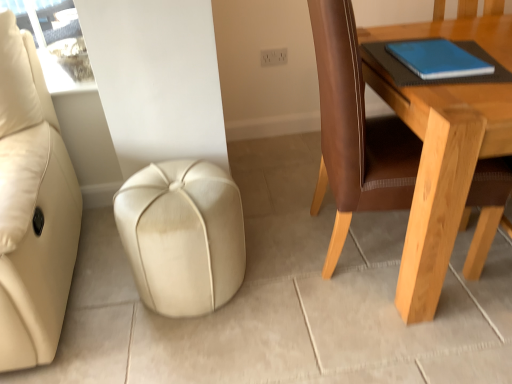
What are the coordinates of `blue matte notebook at upper right` in the screenshot? It's located at (438, 59).

Measure the distance from beige leather ottoman at center to light brown wooden table at right.

beige leather ottoman at center and light brown wooden table at right are 55.42 centimeters apart from each other.

Is beige leather ottoman at center smaller than light brown wooden table at right?

Yes, beige leather ottoman at center is smaller than light brown wooden table at right.

Who is shorter, beige leather ottoman at center or light brown wooden table at right?

Standing shorter between the two is beige leather ottoman at center.

Based on the photo, could you tell me if beige leather ottoman at center is turned towards light brown wooden table at right?

No, beige leather ottoman at center is not turned towards light brown wooden table at right.

In terms of size, does beige leather ottoman at center appear bigger or smaller than blue matte notebook at upper right?

Clearly, beige leather ottoman at center is larger in size than blue matte notebook at upper right.

Which of these two, beige leather ottoman at center or blue matte notebook at upper right, stands shorter?

With less height is blue matte notebook at upper right.

From a real-world perspective, is beige leather ottoman at center located beneath blue matte notebook at upper right?

Yes, from a real-world perspective, beige leather ottoman at center is beneath blue matte notebook at upper right.

Which is behind, beige leather ottoman at center or blue matte notebook at upper right?

beige leather ottoman at center is further from the camera.

Considering the sizes of objects blue matte notebook at upper right and light brown wooden table at right in the image provided, who is taller, blue matte notebook at upper right or light brown wooden table at right?

Standing taller between the two is light brown wooden table at right.

Is blue matte notebook at upper right facing towards light brown wooden table at right?

No, blue matte notebook at upper right is not turned towards light brown wooden table at right.

Would you say blue matte notebook at upper right is to the left or to the right of light brown wooden table at right in the picture?

blue matte notebook at upper right is to the left of light brown wooden table at right.

Which object is more forward, blue matte notebook at upper right or beige leather ottoman at center?

blue matte notebook at upper right.

How much distance is there between blue matte notebook at upper right and beige leather ottoman at center?

A distance of 34.69 inches exists between blue matte notebook at upper right and beige leather ottoman at center.

From the picture: Is blue matte notebook at upper right not close to beige leather ottoman at center?

No, blue matte notebook at upper right is not far from beige leather ottoman at center.

How different are the orientations of light brown wooden table at right and beige leather ottoman at center in degrees?

They differ by 1.3 degrees in their facing directions.

Is light brown wooden table at right turned away from beige leather ottoman at center?

No, light brown wooden table at right is not facing away from beige leather ottoman at center.

From a real-world perspective, is light brown wooden table at right physically above beige leather ottoman at center?

Yes.

Between light brown wooden table at right and beige leather ottoman at center, which one appears on the right side from the viewer's perspective?

light brown wooden table at right is more to the right.

Is light brown wooden table at right with blue matte notebook at upper right?

They are not placed beside each other.

Is light brown wooden table at right further to the viewer compared to blue matte notebook at upper right?

No, light brown wooden table at right is in front of blue matte notebook at upper right.

Is point (510, 60) more distant than point (466, 69)?

That is True.

What's the angular difference between light brown wooden table at right and blue matte notebook at upper right's facing directions?

1.03 degrees.

The height and width of the screenshot is (384, 512). In order to click on stool below the light brown wooden table at right (from the image's perspective) in this screenshot , I will do `click(182, 236)`.

Where is `stool on the left side of blue matte notebook at upper right`? The image size is (512, 384). stool on the left side of blue matte notebook at upper right is located at coordinates (182, 236).

When comparing their distances from light brown wooden table at right, does beige leather ottoman at center or blue matte notebook at upper right seem further?

The object further to light brown wooden table at right is beige leather ottoman at center.

In the scene shown: Considering their positions, is blue matte notebook at upper right positioned closer to beige leather ottoman at center than light brown wooden table at right?

light brown wooden table at right lies closer to beige leather ottoman at center than the other object.

Which object lies further to the anchor point blue matte notebook at upper right, beige leather ottoman at center or light brown wooden table at right?

beige leather ottoman at center is further to blue matte notebook at upper right.

Estimate the real-world distances between objects in this image. Which object is closer to light brown wooden table at right, blue matte notebook at upper right or beige leather ottoman at center?

Among the two, blue matte notebook at upper right is located nearer to light brown wooden table at right.

Considering their positions, is light brown wooden table at right positioned closer to blue matte notebook at upper right than beige leather ottoman at center?

light brown wooden table at right is positioned closer to the anchor blue matte notebook at upper right.

Considering their positions, is light brown wooden table at right positioned closer to beige leather ottoman at center than blue matte notebook at upper right?

light brown wooden table at right is positioned closer to the anchor beige leather ottoman at center.

This screenshot has width=512, height=384. What are the coordinates of `notebook situated between beige leather ottoman at center and light brown wooden table at right from left to right` in the screenshot? It's located at (438, 59).